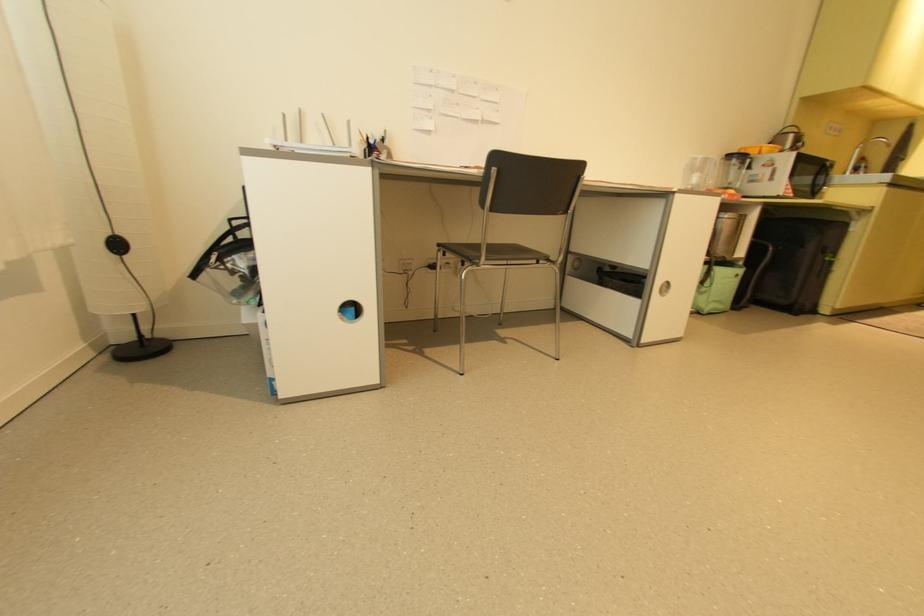
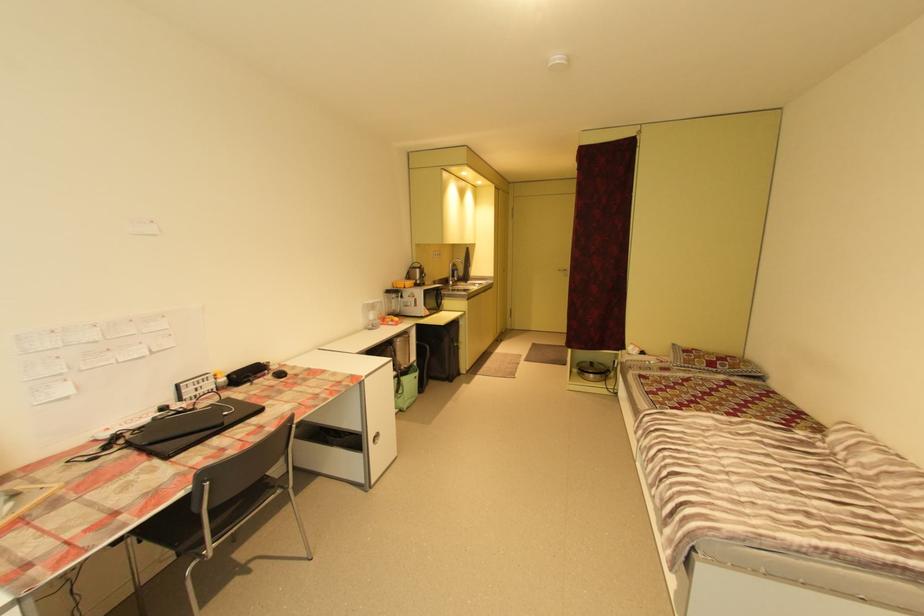
Question: Based on the continuous images, in which direction is the camera rotating? Reply with the corresponding letter.

Choices:
 (A) Left
 (B) Right
 (C) Up
 (D) Down

Answer: (B)